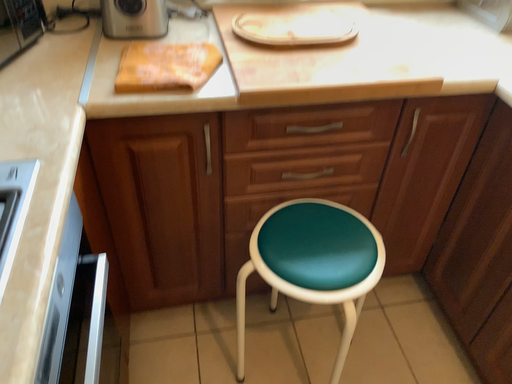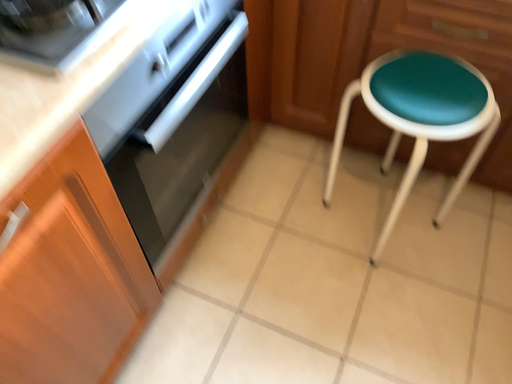
Question: How did the camera likely rotate when shooting the video?

Choices:
 (A) rotated upward
 (B) rotated downward

Answer: (B)